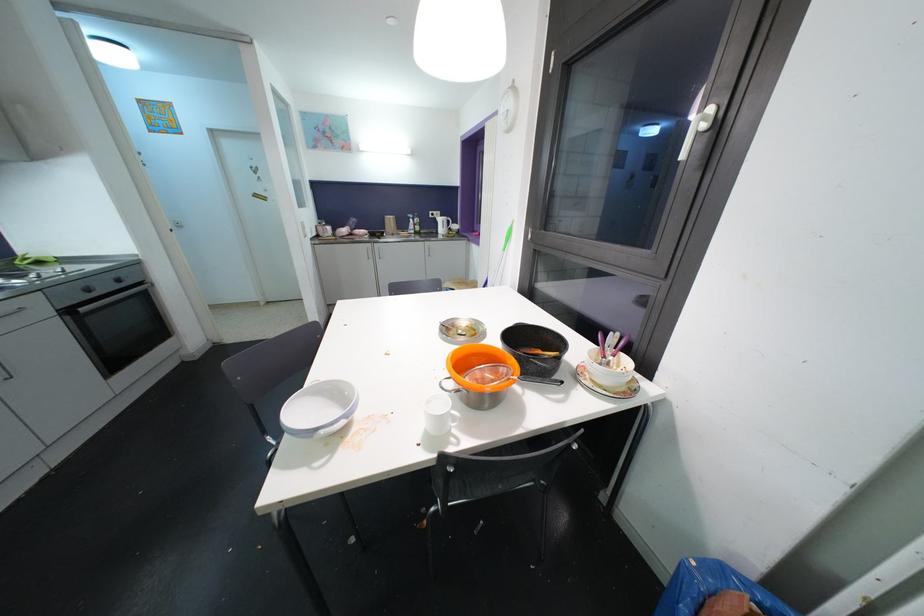
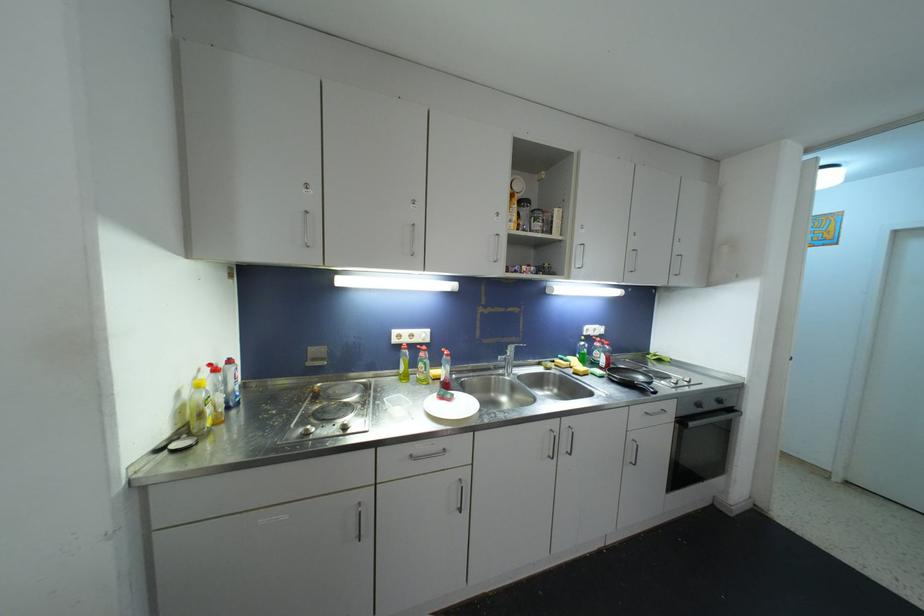
Question: The camera is either moving clockwise (left) or counter-clockwise (right) around the object. The first image is from the beginning of the video and the second image is from the end. Is the camera moving left or right when shooting the video?

Choices:
 (A) Left
 (B) Right

Answer: (B)